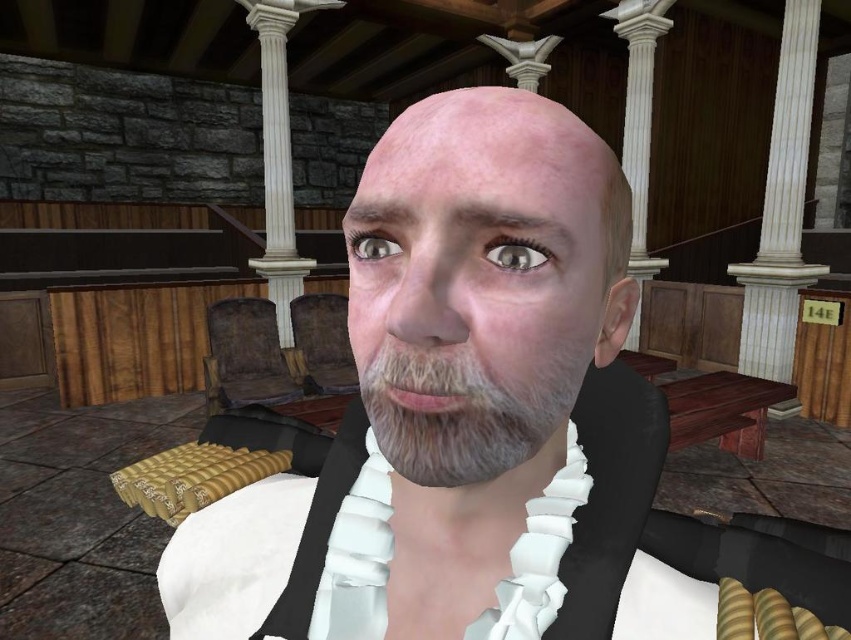
Does white matte/soft fabric at center lie behind graywoolly/fuzzybeard at center?

No, it is in front of graywoolly/fuzzybeard at center.

Can you confirm if white matte/soft fabric at center is positioned above graywoolly/fuzzybeard at center?

No.

Does point (710, 579) lie behind point (483, 451)?

Yes, point (710, 579) is behind point (483, 451).

Locate an element on the screen. Image resolution: width=851 pixels, height=640 pixels. white matte/soft fabric at center is located at coordinates (481, 417).

Does smooth skin face at center appear under shiny gray eye at center?

Correct, smooth skin face at center is located below shiny gray eye at center.

Can you confirm if smooth skin face at center is shorter than shiny gray eye at center?

No.

The width and height of the screenshot is (851, 640). In order to click on smooth skin face at center in this screenshot , I will do `click(484, 284)`.

Image resolution: width=851 pixels, height=640 pixels. Identify the location of smooth skin face at center. (484, 284).